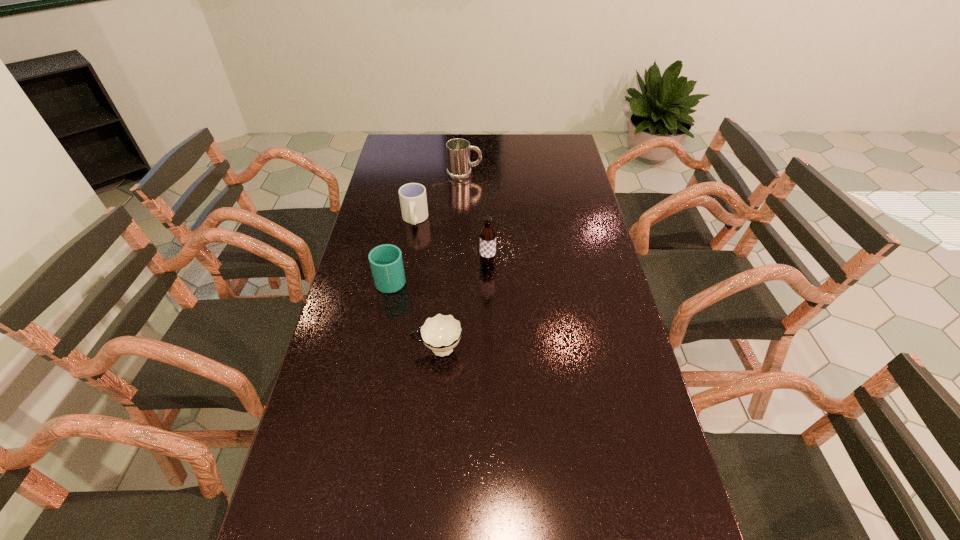
This screenshot has height=540, width=960. Identify the location of vacant area that satisfies the following two spatial constraints: 1. with the handle on the side of the farthest cup; 2. on the side of the rightmost cup with the handle. (393, 350).

The height and width of the screenshot is (540, 960). What are the coordinates of `free location that satisfies the following two spatial constraints: 1. on the side of the mug with the handle; 2. with the handle on the side of the farthest cup` in the screenshot? It's located at (463, 220).